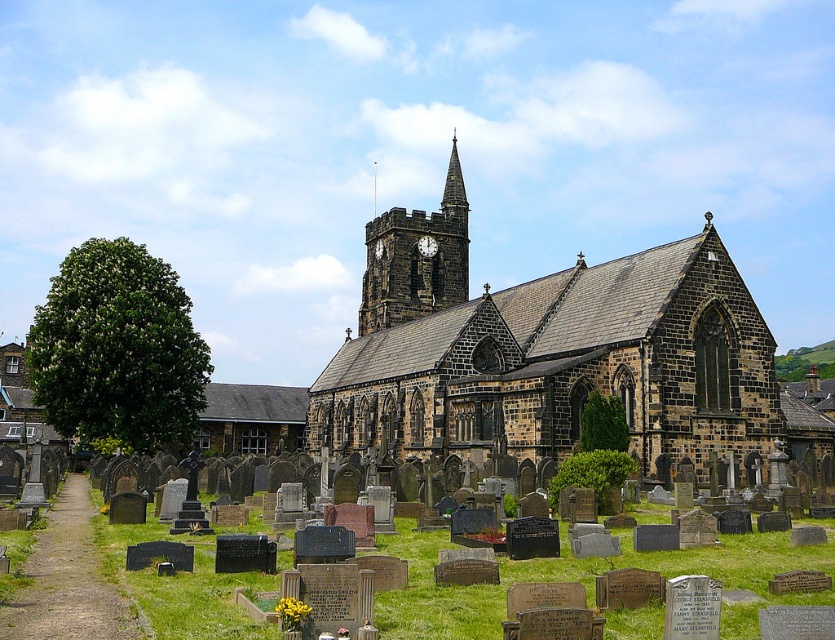
You are standing at the entrance of the cemetery and want to take a photo of the brown stone church at center. Which direction should you face to ensure the church is in the center of your photo?

The brown stone church at center is located at point (545, 353), so you should face towards the center of the image to capture it in the photo.

You are a visitor planning to take a photo of the brown stone church at center and the stone clock tower at center from the cemetery entrance. Which object should you position closer to the camera to ensure both are fully visible in the frame?

The brown stone church at center might be wider than the stone clock tower at center, so positioning the brown stone church at center closer to the camera would help ensure both fit within the frame, as wider objects require more space in the foreground.

You are an architect planning to build a new structure that must fit between the stone clock tower at center and the smooth stone spire at upper center. Given their widths, which of the two structures should you consider as the wider one to ensure proper spacing?

The stone clock tower at center is wider than the smooth stone spire at upper center, so you should consider the stone clock tower at center as the wider one for proper spacing.